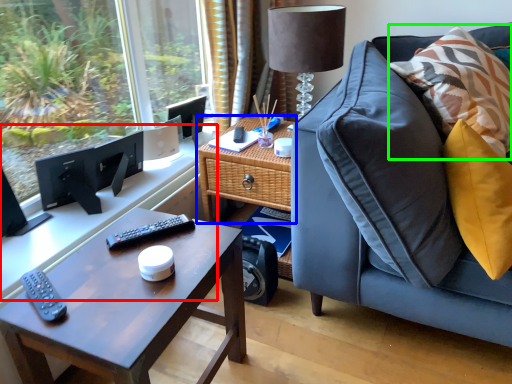
Question: Which is farther away from computer desk (highlighted by a red box)? table (highlighted by a blue box) or pillow (highlighted by a green box)?

Choices:
 (A) table
 (B) pillow

Answer: (B)